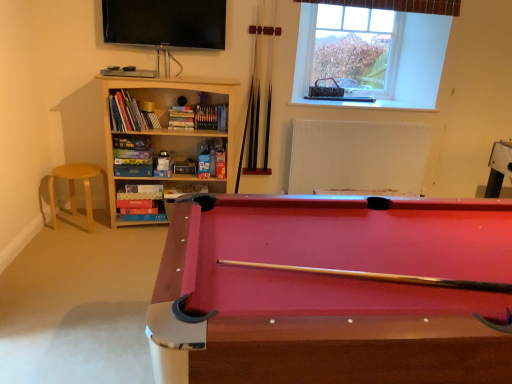
The image size is (512, 384). Describe the element at coordinates (331, 291) in the screenshot. I see `rubberized wood billiard table at lower right` at that location.

This screenshot has height=384, width=512. Find the location of `flat screen tv at upper center`. flat screen tv at upper center is located at coordinates (165, 23).

Image resolution: width=512 pixels, height=384 pixels. What do you see at coordinates (371, 55) in the screenshot? I see `clear glass window at upper center` at bounding box center [371, 55].

In order to click on rubberized wood billiard table at lower right in this screenshot , I will do `click(331, 291)`.

Which object is more forward, flat screen tv at upper center or white matte radiator at upper center?

Positioned in front is flat screen tv at upper center.

Looking at this image, is flat screen tv at upper center facing towards white matte radiator at upper center?

No, flat screen tv at upper center is not oriented towards white matte radiator at upper center.

Considering the sizes of flat screen tv at upper center and white matte radiator at upper center in the image, is flat screen tv at upper center bigger or smaller than white matte radiator at upper center?

In the image, flat screen tv at upper center appears to be smaller than white matte radiator at upper center.

From a real-world perspective, who is located higher, flat screen tv at upper center or white matte radiator at upper center?

From a 3D spatial view, flat screen tv at upper center is above.

Based on their sizes in the image, would you say light wood stool at left is bigger or smaller than clear glass window at upper center?

Clearly, light wood stool at left is larger in size than clear glass window at upper center.

How much distance is there between light wood stool at left and clear glass window at upper center?

A distance of 2.21 meters exists between light wood stool at left and clear glass window at upper center.

From a real-world perspective, is light wood stool at left on top of clear glass window at upper center?

Actually, light wood stool at left is physically below clear glass window at upper center in the real world.

Considering the positions of points (88, 217) and (307, 77), is point (88, 217) closer to camera compared to point (307, 77)?

Yes, it is in front of point (307, 77).

Which of these two, wooden bookcase at left or flat screen tv at upper center, stands taller?

With more height is wooden bookcase at left.

Is wooden bookcase at left oriented away from flat screen tv at upper center?

No.

From the picture: How far apart are clear glass window at upper center and flat screen tv at upper center?

A distance of 1.19 meters exists between clear glass window at upper center and flat screen tv at upper center.

Does point (306, 74) come farther from viewer compared to point (219, 46)?

Yes, it is behind point (219, 46).

This screenshot has height=384, width=512. In order to click on window located underneath the flat screen tv at upper center (from a real-world perspective) in this screenshot , I will do `click(371, 55)`.

Does white matte radiator at upper center have a greater height compared to flat screen tv at upper center?

Correct, white matte radiator at upper center is much taller as flat screen tv at upper center.

Who is more distant, white matte radiator at upper center or flat screen tv at upper center?

white matte radiator at upper center is behind.

Is point (376, 165) positioned before point (176, 37)?

No, (376, 165) is behind (176, 37).

Considering the sizes of objects white matte radiator at upper center and flat screen tv at upper center in the image provided, who is bigger, white matte radiator at upper center or flat screen tv at upper center?

white matte radiator at upper center is bigger.

Which object is thinner, rubberized wood billiard table at lower right or wooden bookcase at left?

Thinner between the two is wooden bookcase at left.

Which object is positioned more to the left, rubberized wood billiard table at lower right or wooden bookcase at left?

From the viewer's perspective, wooden bookcase at left appears more on the left side.

Locate an element on the screen. bookcase behind the rubberized wood billiard table at lower right is located at coordinates (161, 139).

Is white matte radiator at upper center far away from light wood stool at left?

Indeed, white matte radiator at upper center is not near light wood stool at left.

From the image's perspective, is white matte radiator at upper center over light wood stool at left?

Yes, from the image's perspective, white matte radiator at upper center is on top of light wood stool at left.

Which is more to the left, white matte radiator at upper center or light wood stool at left?

Positioned to the left is light wood stool at left.

Where is `television positioned vertically above the white matte radiator at upper center (from a real-world perspective)`? television positioned vertically above the white matte radiator at upper center (from a real-world perspective) is located at coordinates (165, 23).

Locate an element on the screen. bar stool lying in front of the clear glass window at upper center is located at coordinates (75, 192).

Based on their spatial positions, is clear glass window at upper center or rubberized wood billiard table at lower right closer to wooden bookcase at left?

clear glass window at upper center is positioned closer to the anchor wooden bookcase at left.

From the picture: From the image, which object appears to be farther from flat screen tv at upper center, white matte radiator at upper center or clear glass window at upper center?

The object further to flat screen tv at upper center is white matte radiator at upper center.

From the image, which object appears to be farther from clear glass window at upper center, wooden bookcase at left or light wood stool at left?

light wood stool at left lies further to clear glass window at upper center than the other object.

Based on their spatial positions, is flat screen tv at upper center or rubberized wood billiard table at lower right closer to light wood stool at left?

flat screen tv at upper center.

Looking at the image, which one is located closer to wooden bookcase at left, white matte radiator at upper center or flat screen tv at upper center?

flat screen tv at upper center is positioned closer to the anchor wooden bookcase at left.

Estimate the real-world distances between objects in this image. Which object is further from flat screen tv at upper center, light wood stool at left or white matte radiator at upper center?

white matte radiator at upper center.

When comparing their distances from clear glass window at upper center, does flat screen tv at upper center or rubberized wood billiard table at lower right seem further?

Among the two, rubberized wood billiard table at lower right is located further to clear glass window at upper center.

Estimate the real-world distances between objects in this image. Which object is further from light wood stool at left, clear glass window at upper center or white matte radiator at upper center?

Among the two, clear glass window at upper center is located further to light wood stool at left.

The height and width of the screenshot is (384, 512). I want to click on radiator between light wood stool at left and clear glass window at upper center, so click(357, 156).

At what (x,y) coordinates should I click in order to perform the action: click on television between light wood stool at left and clear glass window at upper center from left to right. Please return your answer as a coordinate pair (x, y). The height and width of the screenshot is (384, 512). Looking at the image, I should click on tap(165, 23).

Find the location of a particular element. The width and height of the screenshot is (512, 384). bookcase between rubberized wood billiard table at lower right and clear glass window at upper center in the front-back direction is located at coordinates [x=161, y=139].

What are the coordinates of `radiator between flat screen tv at upper center and clear glass window at upper center` in the screenshot? It's located at (357, 156).